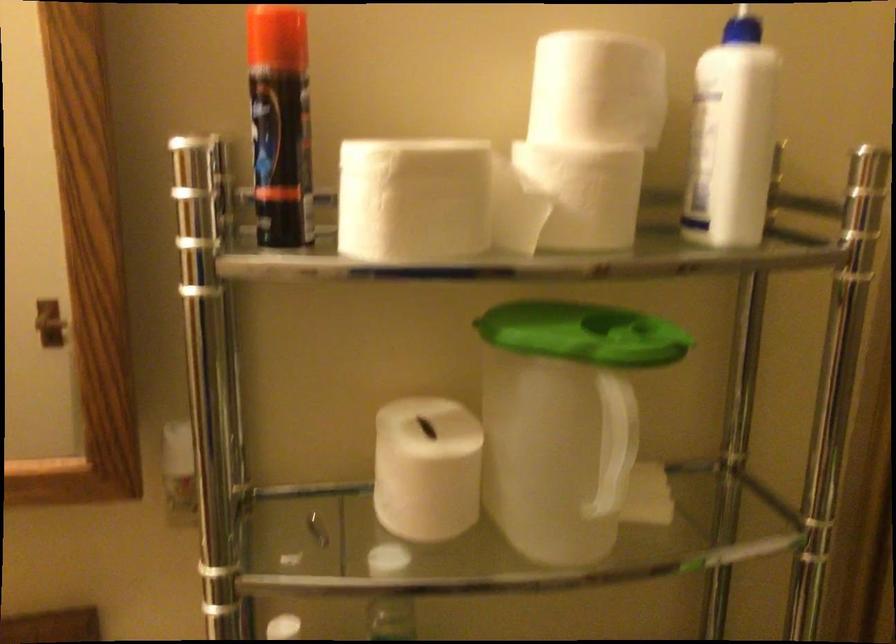
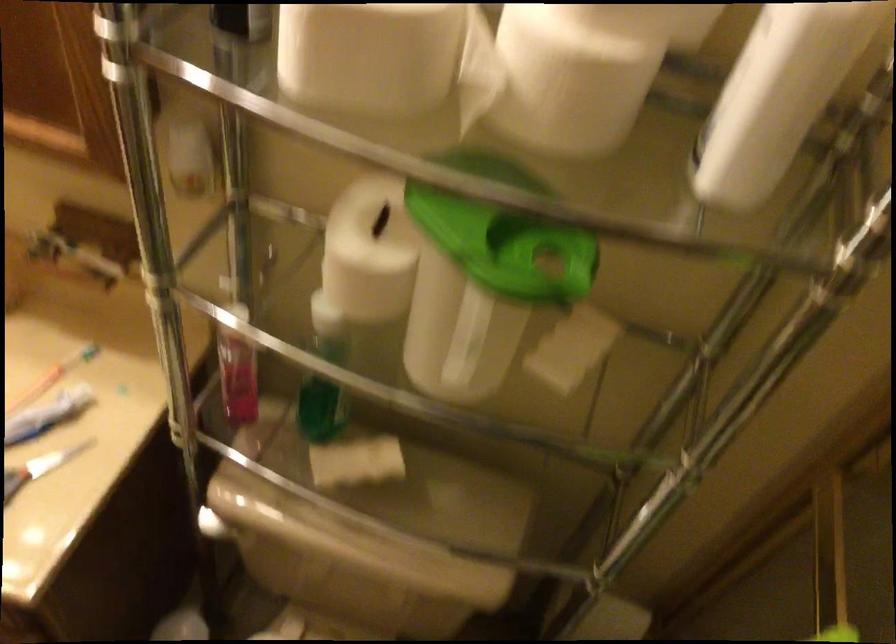
The images are taken continuously from a first-person perspective. In which direction is your viewpoint rotating?

The rotation direction of the camera is left-down.